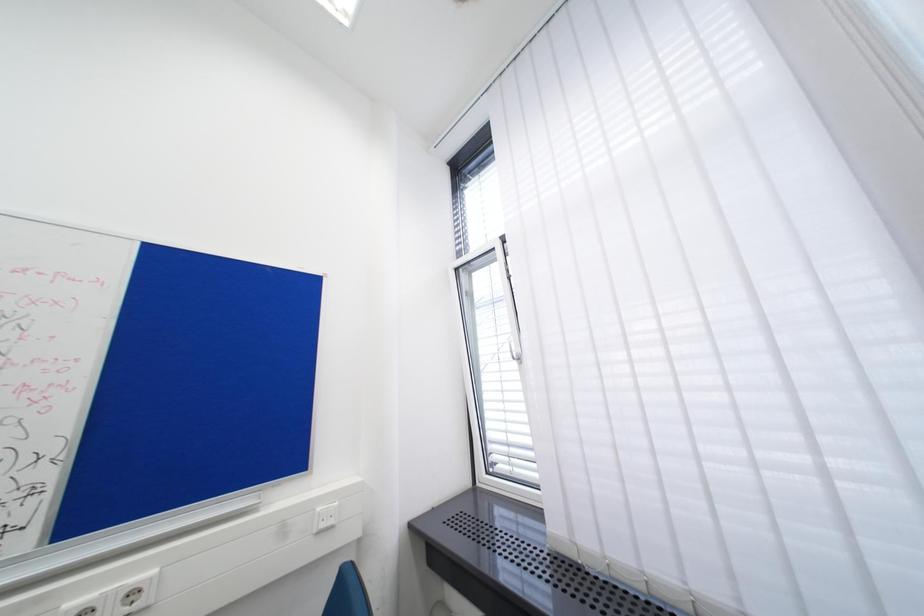
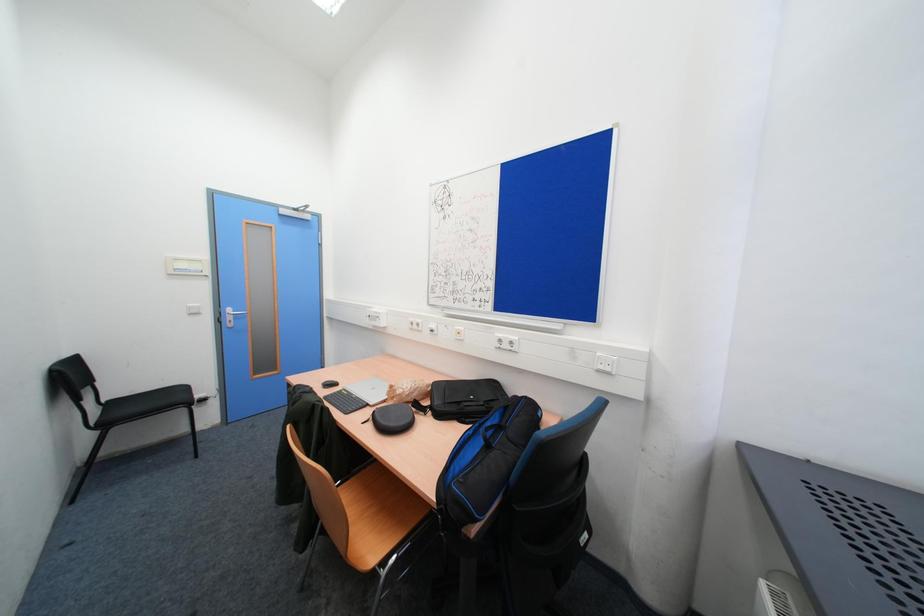
Question: The images are taken continuously from a first-person perspective. In which direction is your viewpoint rotating?

Choices:
 (A) Left
 (B) Right
 (C) Up
 (D) Down

Answer: (A)